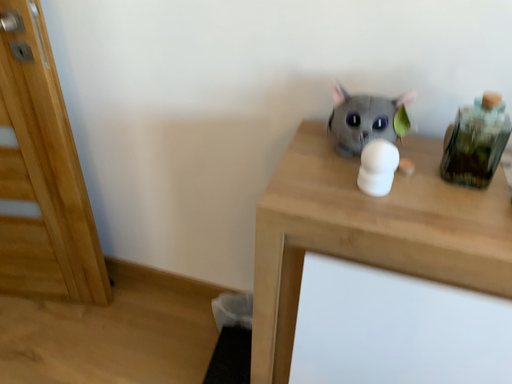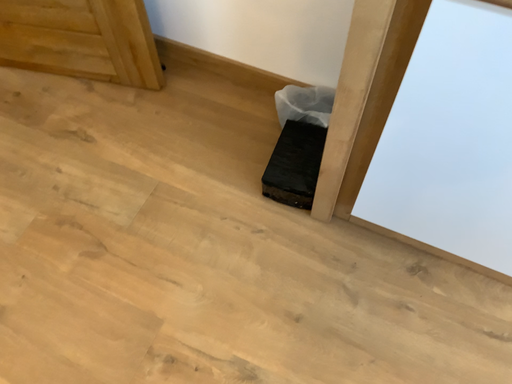
Question: Which way did the camera rotate in the video?

Choices:
 (A) rotated downward
 (B) rotated upward

Answer: (A)